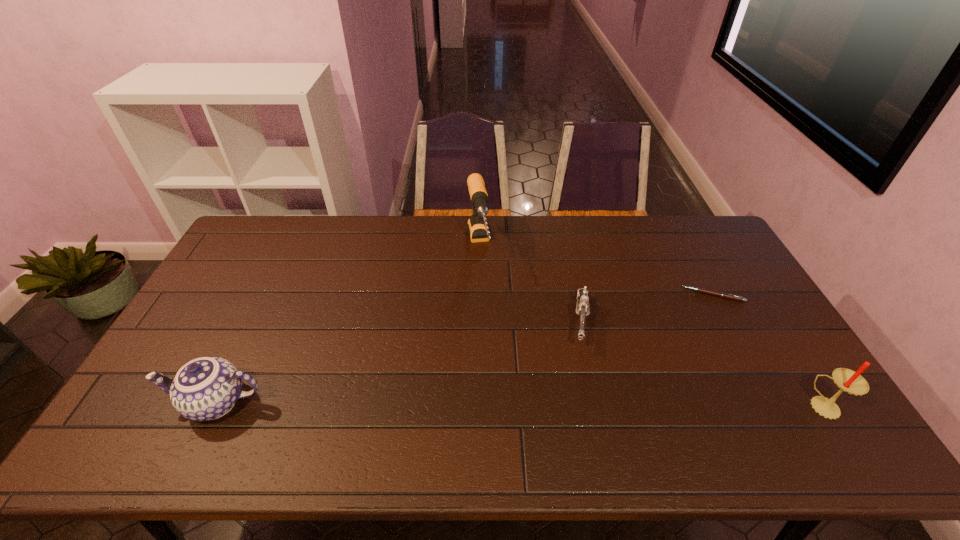
Where is `free area in between the pen and the fourth tallest object`? The height and width of the screenshot is (540, 960). free area in between the pen and the fourth tallest object is located at coordinates (647, 308).

The width and height of the screenshot is (960, 540). In order to click on vacant space that is in between the third object from left to right and the fourth object from left to right in this screenshot , I will do `click(647, 308)`.

Identify the location of empty space between the pen and the chinaware. This screenshot has width=960, height=540. (x=465, y=349).

Image resolution: width=960 pixels, height=540 pixels. What are the coordinates of `empty location between the leftmost object and the fourth object from right to left` in the screenshot? It's located at (348, 324).

Where is `object identified as the third closest to the gun`? This screenshot has width=960, height=540. object identified as the third closest to the gun is located at coordinates (847, 380).

Choose which object is the second nearest neighbor to the fourth object from left to right. Please provide its 2D coordinates. Your answer should be formatted as a tuple, i.e. [(x, y)], where the tuple contains the x and y coordinates of a point satisfying the conditions above.

[(847, 380)]

The height and width of the screenshot is (540, 960). Find the location of `vacant position in the image that satisfies the following two spatial constraints: 1. on the front side of the fourth object from left to right; 2. on the left side of the farthest object`. vacant position in the image that satisfies the following two spatial constraints: 1. on the front side of the fourth object from left to right; 2. on the left side of the farthest object is located at coordinates (478, 295).